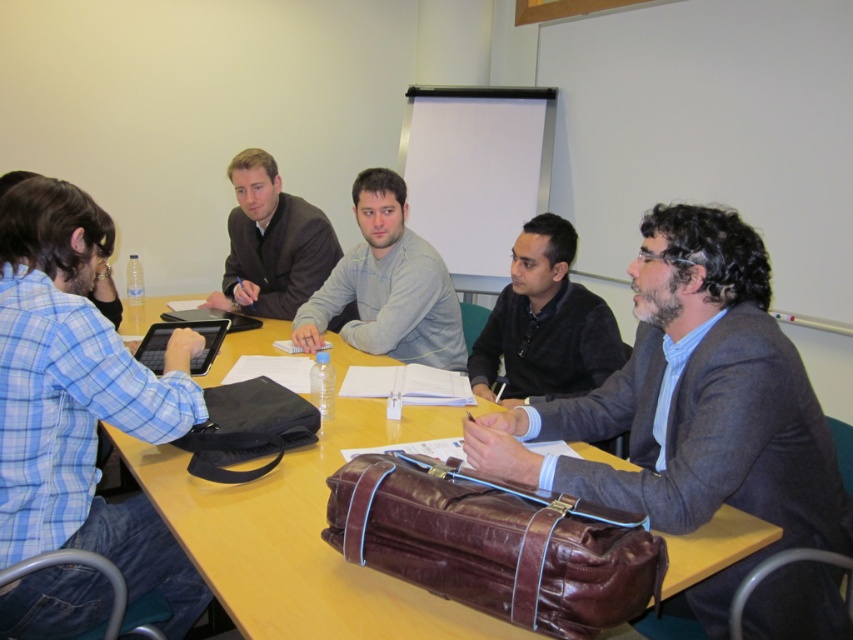
Question: Which of the following is the closest to the observer?

Choices:
 (A) black matte jacket at center
 (B) leather briefcase at lower right
 (C) matte black suit at upper center

Answer: (B)

Question: Among these points, which one is nearest to the camera?

Choices:
 (A) (344, 301)
 (B) (532, 365)
 (C) (164, 296)
 (D) (436, 474)

Answer: (D)

Question: Does black matte jacket at center appear under matte black suit at upper center?

Choices:
 (A) no
 (B) yes

Answer: (B)

Question: Is dark brown leather bag at center smaller than matte black suit at upper center?

Choices:
 (A) no
 (B) yes

Answer: (A)

Question: Is yellow wood table at center to the left of matte black suit at upper center from the viewer's perspective?

Choices:
 (A) no
 (B) yes

Answer: (A)

Question: Which is nearer to the blue plaid shirt at left?

Choices:
 (A) gray fleece sweater at center
 (B) dark brown leather bag at center
 (C) black matte jacket at center

Answer: (A)